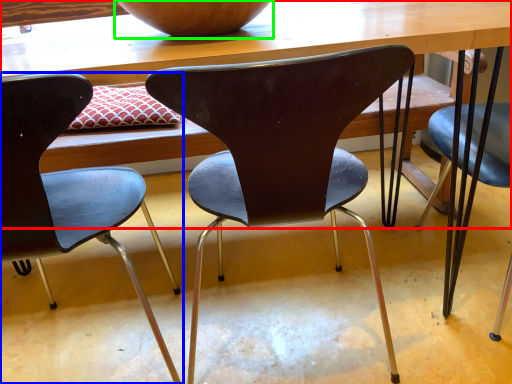
Question: Estimate the real-world distances between objects in this image. Which object is closer to table (highlighted by a red box), chair (highlighted by a blue box) or bowl (highlighted by a green box)?

Choices:
 (A) chair
 (B) bowl

Answer: (B)